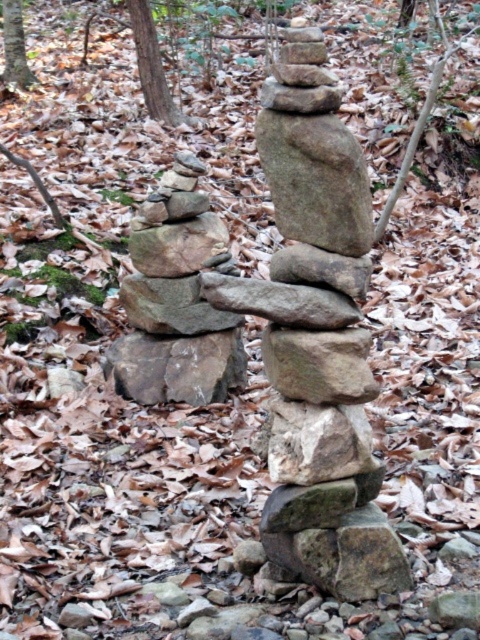
You are a hiker who wants to place a small flag on the highest point of either the natural stone stack at center or the smooth gray rock at center. Which one should you choose?

The natural stone stack at center is taller than the smooth gray rock at center, so you should choose the natural stone stack at center to place the flag.

You are a hiker who wants to build a small shelter using the natural stone stack at center and the rough textured rock at center. Which object should you use as the base for better stability?

The natural stone stack at center is bigger than the rough textured rock at center, so it should be used as the base for better stability.

You are a hiker who has just arrived at a forest area with two stone cairns. You notice a point marked at coordinates (x=317, y=339). According to the map, this point marks a natural stone stack. Which of the two cairns is the natural stone stack?

The point (x=317, y=339) indicates the natural stone stack at center, so the natural stone stack is the one located at the center position between the two cairns.